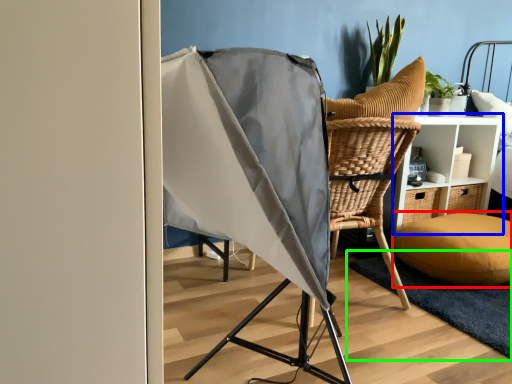
Question: Considering the real-world distances, which object is farthest from pillow (highlighted by a red box)? furniture (highlighted by a blue box) or mat (highlighted by a green box)?

Choices:
 (A) furniture
 (B) mat

Answer: (A)